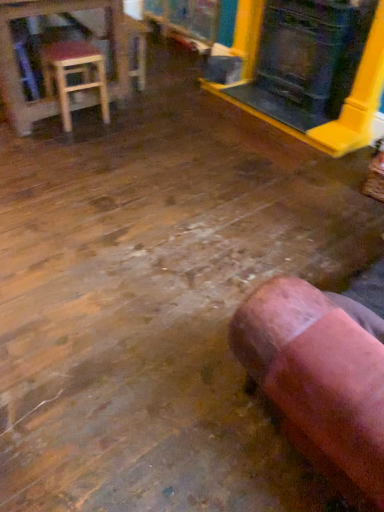
Question: Does wooden stool at upper left have a greater height compared to matte black fireplace at upper right?

Choices:
 (A) yes
 (B) no

Answer: (B)

Question: From a real-world perspective, is wooden stool at upper left over matte black fireplace at upper right?

Choices:
 (A) no
 (B) yes

Answer: (A)

Question: Is wooden stool at upper left to the left of matte black fireplace at upper right from the viewer's perspective?

Choices:
 (A) yes
 (B) no

Answer: (A)

Question: Considering the relative sizes of wooden stool at upper left and matte black fireplace at upper right in the image provided, is wooden stool at upper left bigger than matte black fireplace at upper right?

Choices:
 (A) no
 (B) yes

Answer: (B)

Question: Does wooden stool at upper left come behind matte black fireplace at upper right?

Choices:
 (A) no
 (B) yes

Answer: (B)

Question: From the image's perspective, is wooden stool at upper left on matte black fireplace at upper right?

Choices:
 (A) yes
 (B) no

Answer: (A)

Question: Can you confirm if matte black fireplace at upper right is taller than wooden stool at left?

Choices:
 (A) no
 (B) yes

Answer: (B)

Question: Does matte black fireplace at upper right have a lesser width compared to wooden stool at left?

Choices:
 (A) no
 (B) yes

Answer: (B)

Question: From a real-world perspective, is matte black fireplace at upper right under wooden stool at left?

Choices:
 (A) no
 (B) yes

Answer: (A)

Question: Does matte black fireplace at upper right have a larger size compared to wooden stool at left?

Choices:
 (A) yes
 (B) no

Answer: (A)

Question: Does matte black fireplace at upper right come behind wooden stool at left?

Choices:
 (A) no
 (B) yes

Answer: (A)

Question: Considering the relative positions of matte black fireplace at upper right and wooden stool at left in the image provided, is matte black fireplace at upper right in front of wooden stool at left?

Choices:
 (A) yes
 (B) no

Answer: (A)

Question: Are wooden stool at left and pink suede bean bag chair at lower right beside each other?

Choices:
 (A) yes
 (B) no

Answer: (B)